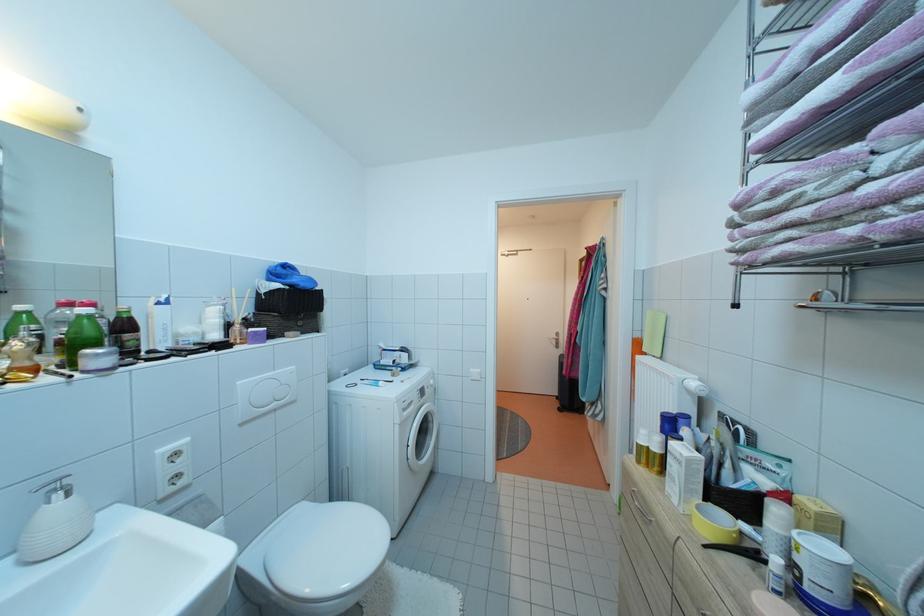
Where would you pull the silver drawer handle? Please return your answer as a coordinate pair (x, y).

(640, 509)